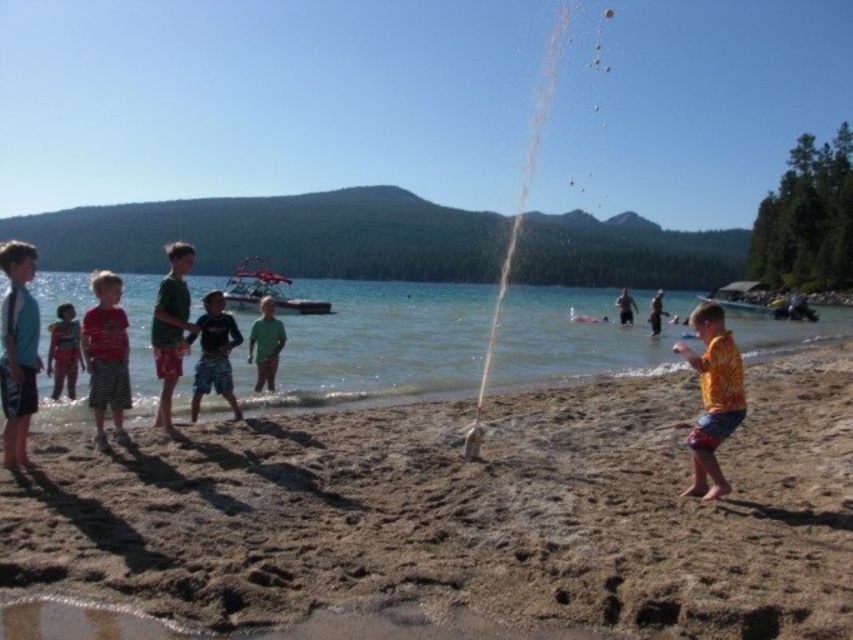
You are a parent watching your children at the beach. You see the clear water at center and the dark blue shorts at center. Which object is higher up in the image?

The clear water at center is much taller than the dark blue shorts at center, so the clear water at center is higher up in the image.

You are standing at the point labeled as point (288, 376) on the beach. You want to throw a ball to a friend who is exactly 20 meters away from you. Is your friend within reach?

The distance between you and the viewer is 19.16 meters, which is less than 20 meters. Therefore, your friend is within reach.